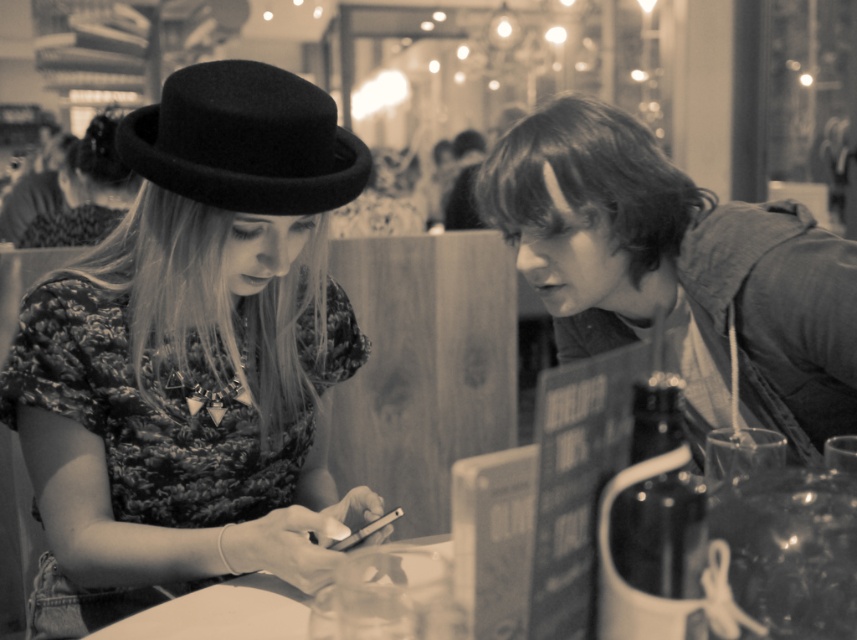
You are a photographer analyzing this black and white photo. You notice two hats at the upper left corner. Which hat is positioned lower between the black felt fedora at upper left and the matte black hat at upper left?

The black felt fedora at upper left is positioned lower than the matte black hat at upper left.

You are a fashion designer analyzing the image. You need to determine which matte black hat is narrower between the matte black hat at left and the matte black hat at upper left. Which one is narrower?

The matte black hat at left is narrower than the matte black hat at upper left because its width is less than the latter.